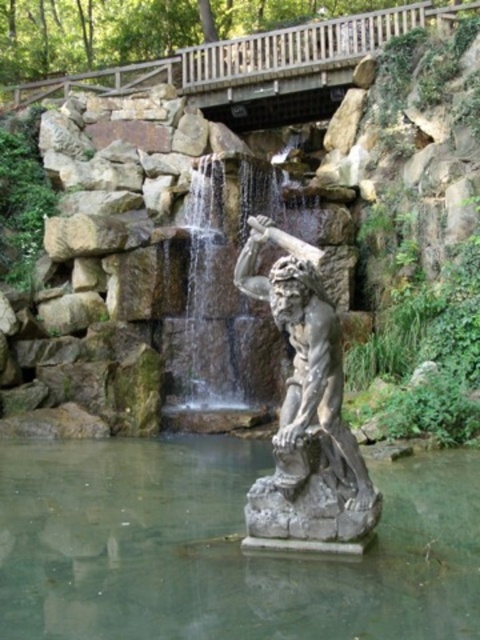
Is the position of stone statue at center less distant than that of clear stone waterfall at center?

Yes.

Is point (315, 422) more distant than point (229, 248)?

No, it is not.

The height and width of the screenshot is (640, 480). What are the coordinates of `stone statue at center` in the screenshot? It's located at (307, 420).

The image size is (480, 640). What are the coordinates of `stone statue at center` in the screenshot? It's located at (307, 420).

Does stone statue at center appear over wooden bridge at upper center?

Incorrect, stone statue at center is not positioned above wooden bridge at upper center.

Is stone statue at center below wooden bridge at upper center?

Yes, stone statue at center is below wooden bridge at upper center.

Is point (312, 444) farther from camera compared to point (334, 52)?

No, (312, 444) is in front of (334, 52).

This screenshot has width=480, height=640. Identify the location of stone statue at center. click(307, 420).

Who is more distant from viewer, (169, 576) or (354, 508)?

Point (354, 508)

Can you confirm if clear stone water at center is bigger than stone statue at center?

No.

Where is `clear stone water at center`? The image size is (480, 640). clear stone water at center is located at coordinates (222, 547).

Identify the location of clear stone water at center. This screenshot has height=640, width=480. (222, 547).